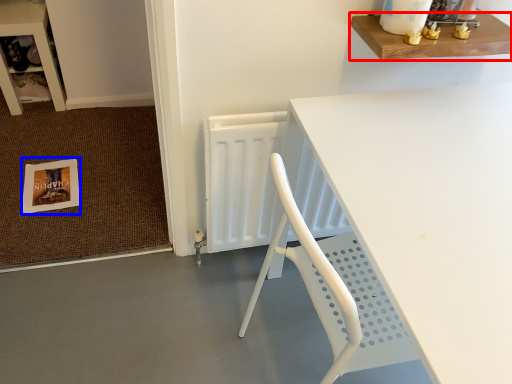
Question: Which object is closer to the camera taking this photo, shelf (highlighted by a red box) or postcard (highlighted by a blue box)?

Choices:
 (A) shelf
 (B) postcard

Answer: (A)